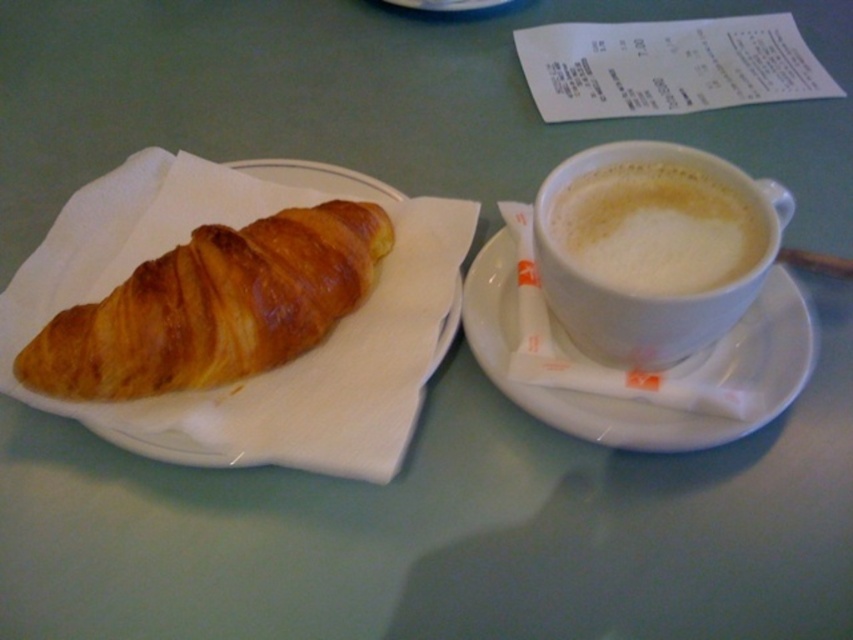
Can you confirm if white frothy latte at right is smaller than white ceramic saucer at right?

Yes, white frothy latte at right is smaller than white ceramic saucer at right.

Who is positioned more to the right, white frothy latte at right or white ceramic saucer at right?

From the viewer's perspective, white frothy latte at right appears more on the right side.

Who is more forward, (538, 252) or (714, 374)?

Positioned in front is point (538, 252).

At what (x,y) coordinates should I click in order to perform the action: click on white frothy latte at right. Please return your answer as a coordinate pair (x, y). The image size is (853, 640). Looking at the image, I should click on (656, 252).

Identify the location of golden brown flaky croissant at left. This screenshot has height=640, width=853. (213, 307).

Does point (68, 323) come in front of point (741, 195)?

No, (68, 323) is behind (741, 195).

What do you see at coordinates (213, 307) in the screenshot? The height and width of the screenshot is (640, 853). I see `golden brown flaky croissant at left` at bounding box center [213, 307].

At what (x,y) coordinates should I click in order to perform the action: click on golden brown flaky croissant at left. Please return your answer as a coordinate pair (x, y). This screenshot has width=853, height=640. Looking at the image, I should click on (213, 307).

How much distance is there between golden brown flaky croissant at left and white frothy latte at right?

golden brown flaky croissant at left and white frothy latte at right are 8.94 inches apart.

Is point (248, 262) farther from camera compared to point (670, 321)?

Yes, point (248, 262) is behind point (670, 321).

Locate an element on the screen. The image size is (853, 640). golden brown flaky croissant at left is located at coordinates (213, 307).